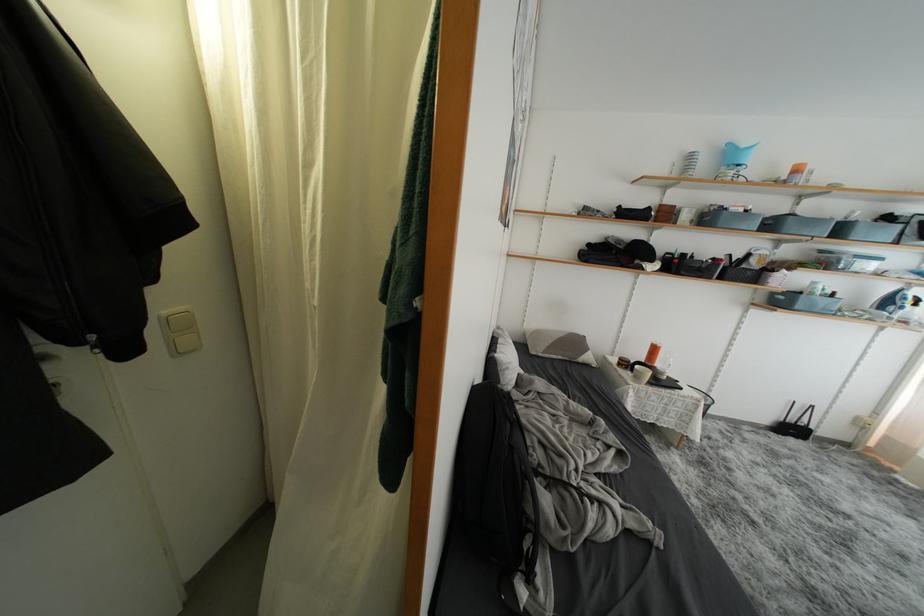
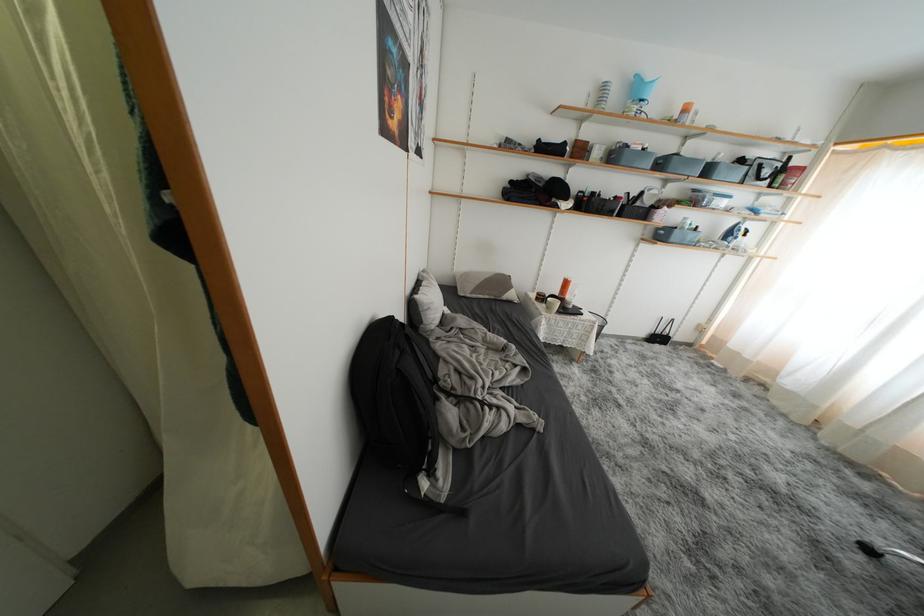
Find the pixel in the second image that matches pixel 700 215 in the first image.

(610, 152)